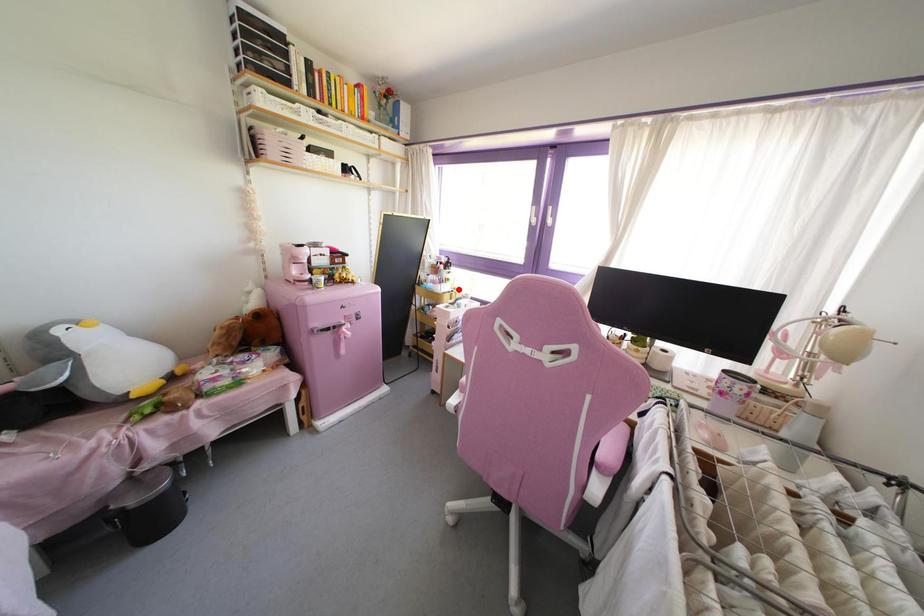
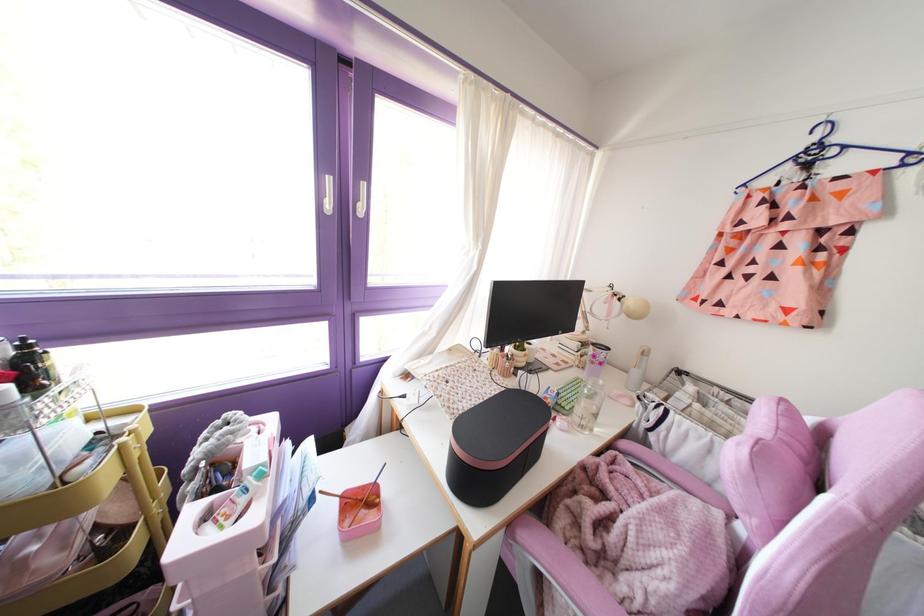
Where in the second image is the point corresponding to the highlighted location from the first image?

(130, 411)